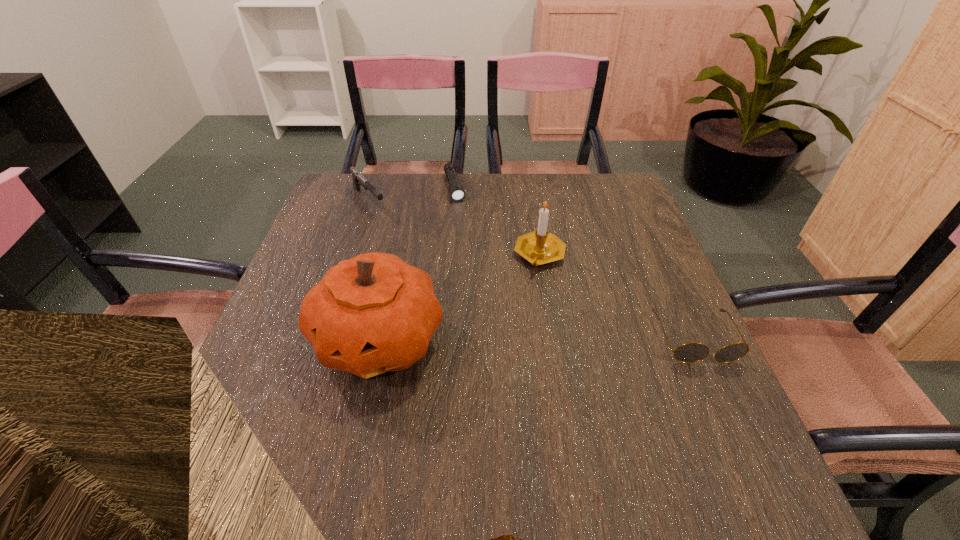
Find the location of a particular element. This screenshot has height=540, width=960. pumpkin that is at the left edge is located at coordinates (374, 313).

Locate an element on the screen. Image resolution: width=960 pixels, height=540 pixels. gun at the left edge is located at coordinates (358, 180).

The image size is (960, 540). In order to click on object that is at the right edge in this screenshot , I will do `click(692, 352)`.

Identify the location of object positioned at the far left corner. This screenshot has width=960, height=540. (358, 180).

Where is `blank space at the far edge of the desktop`? The height and width of the screenshot is (540, 960). blank space at the far edge of the desktop is located at coordinates (409, 210).

Where is `free location at the near edge`? free location at the near edge is located at coordinates (591, 440).

Locate an element on the screen. vacant area at the left edge is located at coordinates (300, 278).

At what (x,y) coordinates should I click in order to perform the action: click on vacant area at the right edge. Please return your answer as a coordinate pair (x, y). Looking at the image, I should click on (620, 262).

At what (x,y) coordinates should I click in order to perform the action: click on vacant space at the far left corner. Please return your answer as a coordinate pair (x, y). The height and width of the screenshot is (540, 960). Looking at the image, I should click on (350, 179).

You are a GUI agent. You are given a task and a screenshot of the screen. Output one action in this format:
    pyautogui.click(x=<x>, y=<y>)
    Task: Click on the free location at the near left corner of the desktop
    This screenshot has width=960, height=540.
    Given the screenshot: What is the action you would take?
    pyautogui.click(x=263, y=415)